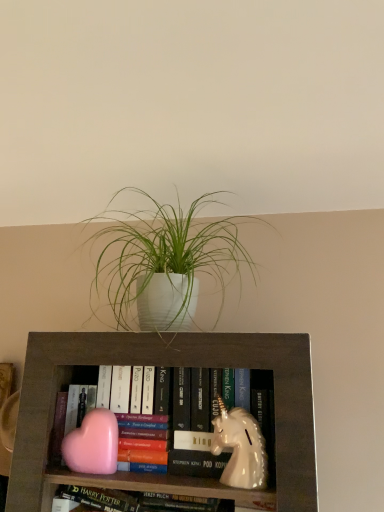
Question: From a real-world perspective, is pink matte heart at lower left, the first animal positioned from the left, on top of white matte plant pot at upper center?

Choices:
 (A) no
 (B) yes

Answer: (A)

Question: Does pink matte heart at lower left, the first animal positioned from the left, have a larger size compared to white matte plant pot at upper center?

Choices:
 (A) no
 (B) yes

Answer: (A)

Question: Can you confirm if pink matte heart at lower left, the second animal in the right-to-left sequence, is shorter than white matte plant pot at upper center?

Choices:
 (A) no
 (B) yes

Answer: (B)

Question: Is pink matte heart at lower left, the first animal positioned from the left, facing away from white matte plant pot at upper center?

Choices:
 (A) yes
 (B) no

Answer: (B)

Question: From the image's perspective, is pink matte heart at lower left, the second animal in the right-to-left sequence, beneath white matte plant pot at upper center?

Choices:
 (A) no
 (B) yes

Answer: (B)

Question: Considering the relative sizes of pink matte heart at lower left, the second animal in the right-to-left sequence, and white matte plant pot at upper center in the image provided, is pink matte heart at lower left, the second animal in the right-to-left sequence, taller than white matte plant pot at upper center?

Choices:
 (A) no
 (B) yes

Answer: (A)

Question: Would you say white matte plant pot at upper center is a long distance from white glossy unicorn at center, which is counted as the second animal, starting from the left?

Choices:
 (A) yes
 (B) no

Answer: (B)

Question: Is white matte plant pot at upper center smaller than white glossy unicorn at center, which is counted as the second animal, starting from the left?

Choices:
 (A) yes
 (B) no

Answer: (B)

Question: From the image's perspective, does white matte plant pot at upper center appear lower than white glossy unicorn at center, the 1th animal viewed from the right?

Choices:
 (A) yes
 (B) no

Answer: (B)

Question: Can white glossy unicorn at center, the 1th animal viewed from the right, be found inside white matte plant pot at upper center?

Choices:
 (A) no
 (B) yes

Answer: (A)

Question: From the image's perspective, does white matte plant pot at upper center appear higher than white glossy unicorn at center, which is counted as the second animal, starting from the left?

Choices:
 (A) no
 (B) yes

Answer: (B)

Question: Can you confirm if white matte plant pot at upper center is shorter than white glossy unicorn at center, which is counted as the second animal, starting from the left?

Choices:
 (A) no
 (B) yes

Answer: (A)

Question: Is white matte plant pot at upper center facing towards pink matte heart at lower left, the first animal positioned from the left?

Choices:
 (A) no
 (B) yes

Answer: (A)